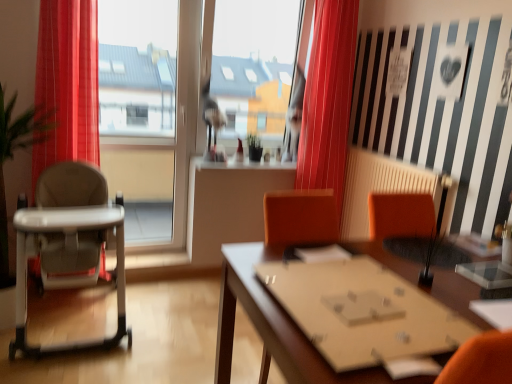
Question: From the image's perspective, is red velvet curtain at center beneath wooden table at center?

Choices:
 (A) yes
 (B) no

Answer: (B)

Question: Does red velvet curtain at center appear on the right side of wooden table at center?

Choices:
 (A) no
 (B) yes

Answer: (A)

Question: Is red velvet curtain at center placed right next to wooden table at center?

Choices:
 (A) no
 (B) yes

Answer: (A)

Question: Is red velvet curtain at center to the left of wooden table at center from the viewer's perspective?

Choices:
 (A) yes
 (B) no

Answer: (A)

Question: Does red velvet curtain at center have a lesser height compared to wooden table at center?

Choices:
 (A) yes
 (B) no

Answer: (B)

Question: From the image's perspective, is white plastic highchair at left above or below wooden table at center?

Choices:
 (A) above
 (B) below

Answer: (A)

Question: Considering the positions of white plastic highchair at left and wooden table at center in the image, is white plastic highchair at left wider or thinner than wooden table at center?

Choices:
 (A) wide
 (B) thin

Answer: (B)

Question: Do you think white plastic highchair at left is within wooden table at center, or outside of it?

Choices:
 (A) outside
 (B) inside

Answer: (A)

Question: Considering the positions of white plastic highchair at left and wooden table at center in the image, is white plastic highchair at left taller or shorter than wooden table at center?

Choices:
 (A) short
 (B) tall

Answer: (B)

Question: Is wooden table at center in front of or behind transparent glass window at center in the image?

Choices:
 (A) behind
 (B) front

Answer: (B)

Question: Based on their positions, is wooden table at center located to the left or right of transparent glass window at center?

Choices:
 (A) left
 (B) right

Answer: (B)

Question: Is wooden table at center wider or thinner than transparent glass window at center?

Choices:
 (A) thin
 (B) wide

Answer: (B)

Question: From the image's perspective, relative to transparent glass window at center, is wooden table at center above or below?

Choices:
 (A) below
 (B) above

Answer: (A)

Question: Does point (x=437, y=183) appear closer or farther from the camera than point (x=34, y=345)?

Choices:
 (A) farther
 (B) closer

Answer: (A)

Question: Considering their positions, is beige radiator at center located in front of or behind white plastic highchair at left?

Choices:
 (A) front
 (B) behind

Answer: (B)